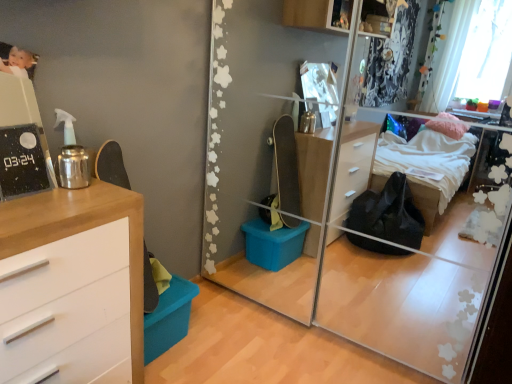
Where is `blank space situated above wooden chest of drawers at left (from a real-world perspective)`? This screenshot has width=512, height=384. blank space situated above wooden chest of drawers at left (from a real-world perspective) is located at coordinates (41, 202).